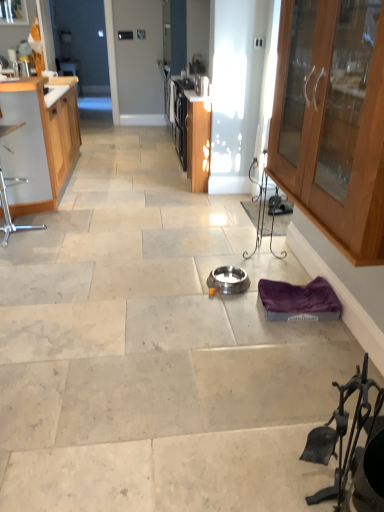
This screenshot has height=512, width=384. What are the coordinates of `vacant region under black wrought iron fireplace tools at lower right, acting as the second chair starting from the back (from a real-world perspective)` in the screenshot? It's located at (316, 484).